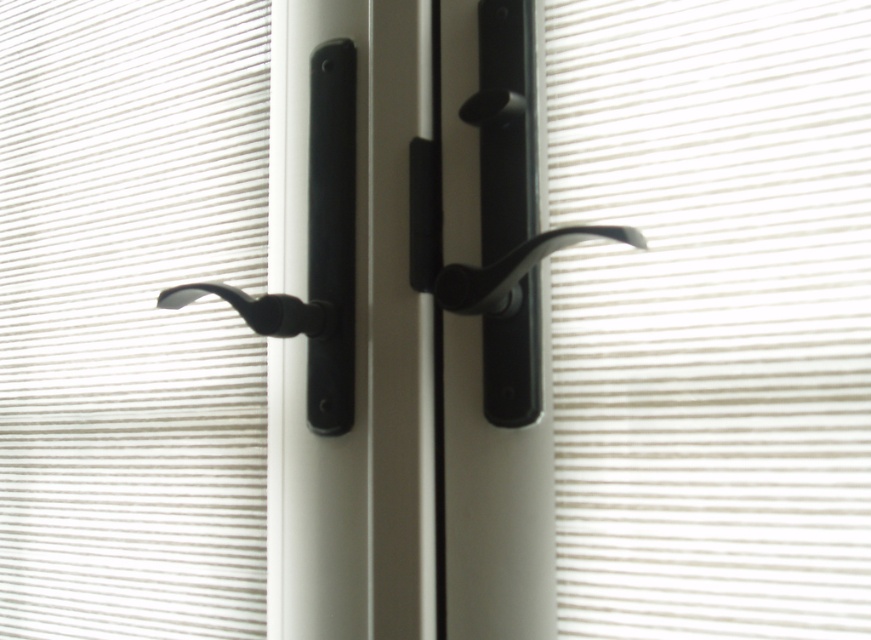
Does white matte blind at left come in front of black matte door handle at center?

No, it is behind black matte door handle at center.

In order to click on white matte blind at left in this screenshot , I will do `click(132, 317)`.

Image resolution: width=871 pixels, height=640 pixels. In order to click on white matte blind at left in this screenshot , I will do `click(132, 317)`.

Is point (699, 433) positioned before point (460, 296)?

No, (699, 433) is further to viewer.

Can you confirm if white matte blind at center is taller than black matte door handle at center?

Yes.

Find the location of a particular element. white matte blind at center is located at coordinates [711, 316].

Is white matte blind at center closer to the viewer compared to matte black lever at center?

Yes, white matte blind at center is closer to the viewer.

Who is more forward, [652,465] or [329,378]?

Point [652,465] is more forward.

You are a GUI agent. You are given a task and a screenshot of the screen. Output one action in this format:
    pyautogui.click(x=<x>, y=<y>)
    Task: Click on the white matte blind at center
    This screenshot has width=871, height=640.
    Given the screenshot: What is the action you would take?
    pyautogui.click(x=711, y=316)